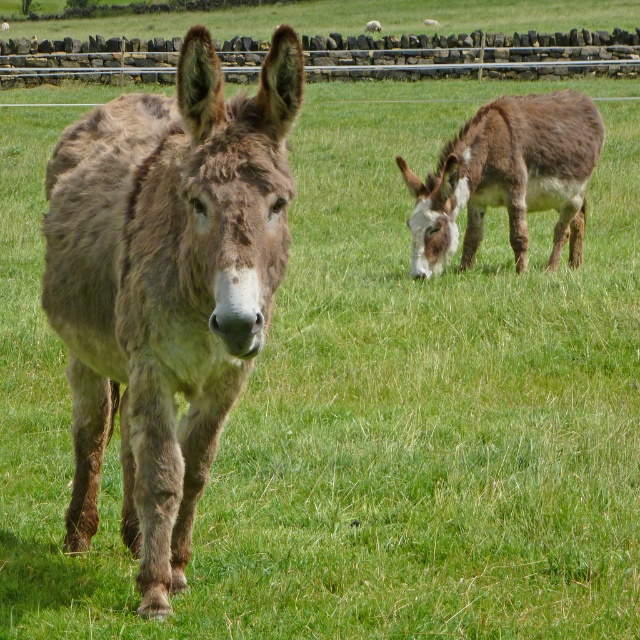
Who is shorter, brown fuzzy donkey at center or brushed metal fence at upper center?

With less height is brown fuzzy donkey at center.

Is brown fuzzy donkey at center bigger than brushed metal fence at upper center?

No.

Is point (195, 492) positioned in front of point (328, 42)?

Yes.

The width and height of the screenshot is (640, 640). What are the coordinates of `brown fuzzy donkey at center` in the screenshot? It's located at (166, 285).

What do you see at coordinates (508, 177) in the screenshot? I see `brown fuzzy mule at right` at bounding box center [508, 177].

In order to click on brown fuzzy mule at right in this screenshot , I will do `click(508, 177)`.

Where is `brown fuzzy mule at right`? brown fuzzy mule at right is located at coordinates (508, 177).

This screenshot has width=640, height=640. What are the coordinates of `brown fuzzy mule at right` in the screenshot? It's located at (508, 177).

Between brown fuzzy donkey at center and brown fuzzy mule at right, which one appears on the left side from the viewer's perspective?

Positioned to the left is brown fuzzy donkey at center.

Measure the distance between point (x=204, y=88) and camera.

A distance of 3.53 meters exists between point (x=204, y=88) and camera.

Locate an element on the screen. brown fuzzy donkey at center is located at coordinates (166, 285).